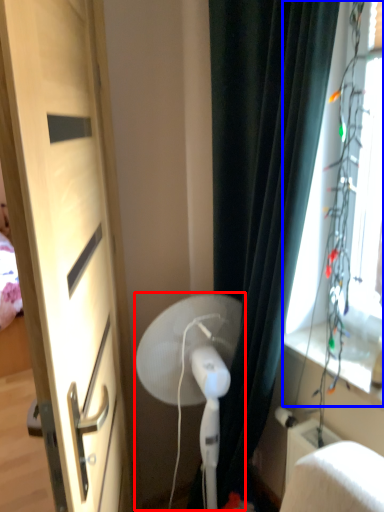
Question: Which object appears closest to the camera in this image, fan (highlighted by a red box) or window screen (highlighted by a blue box)?

Choices:
 (A) fan
 (B) window screen

Answer: (B)